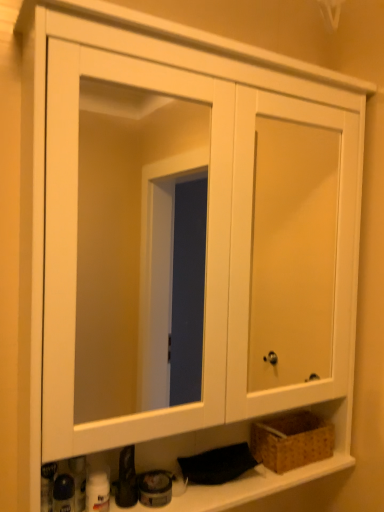
The height and width of the screenshot is (512, 384). What do you see at coordinates (291, 440) in the screenshot? I see `brown woven basket at lower right` at bounding box center [291, 440].

Find the location of a particular element. The width and height of the screenshot is (384, 512). brown woven basket at lower right is located at coordinates (291, 440).

I want to click on brown woven basket at lower right, so click(x=291, y=440).